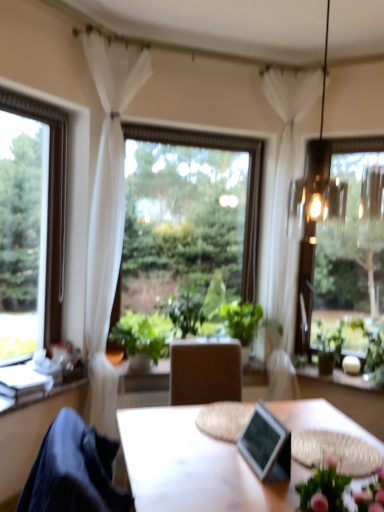
Question: Are green leafy plant at center, positioned as the second houseplant in right-to-left order, and green leafy plant at center, arranged as the third houseplant when viewed from the right, far apart?

Choices:
 (A) no
 (B) yes

Answer: (A)

Question: Does green leafy plant at center, positioned as the 2th houseplant in left-to-right order, turn towards green leafy plant at center, the first houseplant from the left?

Choices:
 (A) yes
 (B) no

Answer: (B)

Question: Does green leafy plant at center, positioned as the 2th houseplant in left-to-right order, have a lesser height compared to green leafy plant at center, the first houseplant from the left?

Choices:
 (A) yes
 (B) no

Answer: (B)

Question: Is green leafy plant at center, positioned as the 2th houseplant in left-to-right order, thinner than green leafy plant at center, the first houseplant from the left?

Choices:
 (A) yes
 (B) no

Answer: (B)

Question: Would you say green leafy plant at center, positioned as the 2th houseplant in left-to-right order, contains green leafy plant at center, arranged as the third houseplant when viewed from the right?

Choices:
 (A) no
 (B) yes

Answer: (A)

Question: Considering the relative sizes of green leafy plant at center, positioned as the 2th houseplant in left-to-right order, and green leafy plant at center, the first houseplant from the left, in the image provided, is green leafy plant at center, positioned as the 2th houseplant in left-to-right order, smaller than green leafy plant at center, the first houseplant from the left,?

Choices:
 (A) yes
 (B) no

Answer: (B)

Question: Is dark blue fabric at lower left surrounding clear glass window at left, which is the 3th window from right to left?

Choices:
 (A) yes
 (B) no

Answer: (B)

Question: Considering the relative sizes of dark blue fabric at lower left and clear glass window at left, which is the 3th window from right to left, in the image provided, is dark blue fabric at lower left bigger than clear glass window at left, which is the 3th window from right to left,?

Choices:
 (A) no
 (B) yes

Answer: (B)

Question: From a real-world perspective, does dark blue fabric at lower left sit lower than clear glass window at left, which is the 3th window from right to left?

Choices:
 (A) yes
 (B) no

Answer: (A)

Question: Does dark blue fabric at lower left lie behind clear glass window at left, which is the 3th window from right to left?

Choices:
 (A) yes
 (B) no

Answer: (B)

Question: From a real-world perspective, is dark blue fabric at lower left on top of clear glass window at left, which ranks as the first window in left-to-right order?

Choices:
 (A) yes
 (B) no

Answer: (B)

Question: Is dark blue fabric at lower left to the left of clear glass window at left, which is the 3th window from right to left, from the viewer's perspective?

Choices:
 (A) no
 (B) yes

Answer: (A)

Question: Does green leafy plant at right, which is the third houseplant in left-to-right order, have a lesser width compared to metallic silver picture frame at center?

Choices:
 (A) yes
 (B) no

Answer: (B)